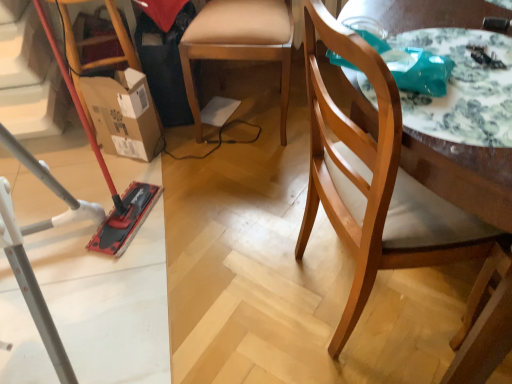
Question: Does cardboard box at left turn towards brushed metal vacuum cleaner at left?

Choices:
 (A) yes
 (B) no

Answer: (B)

Question: Is cardboard box at left turned away from brushed metal vacuum cleaner at left?

Choices:
 (A) no
 (B) yes

Answer: (A)

Question: Is cardboard box at left placed right next to brushed metal vacuum cleaner at left?

Choices:
 (A) yes
 (B) no

Answer: (B)

Question: From a real-world perspective, is cardboard box at left located higher than brushed metal vacuum cleaner at left?

Choices:
 (A) yes
 (B) no

Answer: (B)

Question: Is cardboard box at left behind brushed metal vacuum cleaner at left?

Choices:
 (A) yes
 (B) no

Answer: (A)

Question: Is brushed metal vacuum cleaner at left surrounded by cardboard box at left?

Choices:
 (A) yes
 (B) no

Answer: (B)

Question: Is wooden chair at right, the 2th chair when ordered from back to front, not close to cardboard box at left?

Choices:
 (A) no
 (B) yes

Answer: (A)

Question: Is wooden chair at right, which is the first chair from front to back, wider than cardboard box at left?

Choices:
 (A) yes
 (B) no

Answer: (A)

Question: From the image's perspective, is wooden chair at right, which is the first chair from front to back, located above cardboard box at left?

Choices:
 (A) yes
 (B) no

Answer: (B)

Question: Can you confirm if wooden chair at right, which is the first chair from front to back, is taller than cardboard box at left?

Choices:
 (A) no
 (B) yes

Answer: (B)

Question: Could you tell me if wooden chair at right, the 2th chair when ordered from back to front, is turned towards cardboard box at left?

Choices:
 (A) yes
 (B) no

Answer: (B)

Question: Is cardboard box at left inside wooden chair at right, which is the first chair from front to back?

Choices:
 (A) no
 (B) yes

Answer: (A)

Question: Considering the relative sizes of wooden chair at right, the 2th chair when ordered from back to front, and white glossy table at upper right in the image provided, is wooden chair at right, the 2th chair when ordered from back to front, smaller than white glossy table at upper right?

Choices:
 (A) yes
 (B) no

Answer: (B)